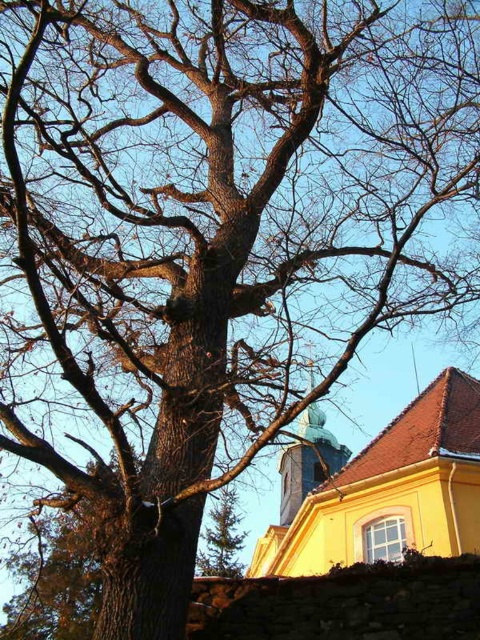
You are a drone operator trying to fly a drone between the light brown stone tower at center and the green textured pine tree at center. The drone has a wingspan of 2 meters. Can the drone safely pass through the space between them?

The light brown stone tower at center and green textured pine tree at center are 6.65 meters apart from each other. Since the drone has a wingspan of 2 meters, there is sufficient space for it to pass safely between them.

Based on the scene description, where is the light brown stone tower at center located in terms of coordinates?

The light brown stone tower at center is located at coordinates point (308, 461).

You are an architect designing a new garden layout. You need to place a statue between the yellow matte church at upper center and the light brown stone tower at center. Which side of the statue should face the wider structure?

The yellow matte church at upper center is wider than the light brown stone tower at center. Therefore, the statue should face the yellow matte church at upper center since it is the wider structure.